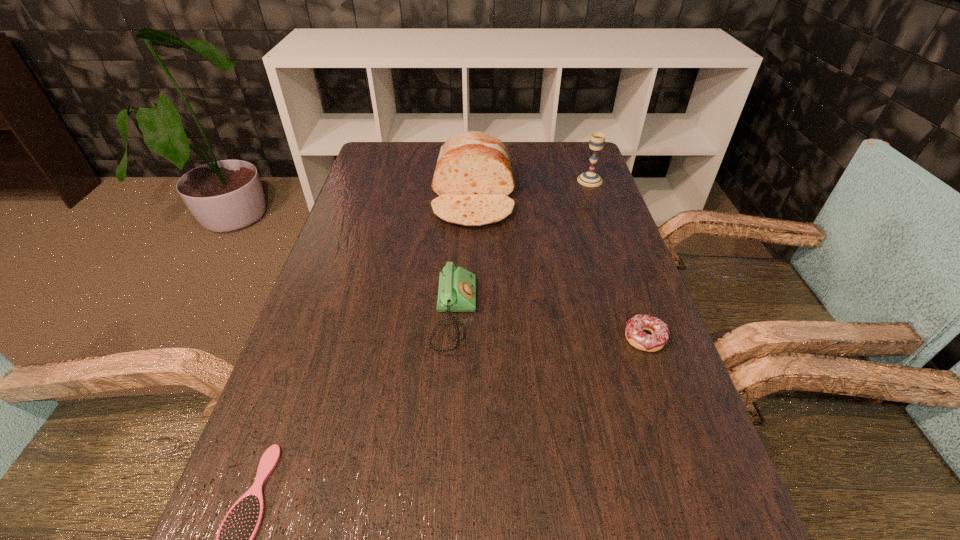
Identify the location of vacant space that is in between the chalice and the third shortest object. (522, 248).

Identify the location of vacant point located between the bread and the fourth tallest object. (559, 268).

At what (x,y) coordinates should I click in order to perform the action: click on vacant region between the fourth tallest object and the telephone. Please return your answer as a coordinate pair (x, y). The width and height of the screenshot is (960, 540). Looking at the image, I should click on (549, 327).

Locate an element on the screen. free space between the telephone and the bread is located at coordinates (464, 256).

Locate an element on the screen. The image size is (960, 540). unoccupied area between the doughnut and the bread is located at coordinates (559, 268).

Locate an element on the screen. vacant space in between the bread and the second shortest object is located at coordinates (559, 268).

The height and width of the screenshot is (540, 960). What are the coordinates of `object that ranks as the fourth closest to the fourth tallest object` in the screenshot? It's located at click(x=235, y=539).

The image size is (960, 540). I want to click on object that is the second closest to the second shortest object, so click(473, 178).

Find the location of a particular element. Image resolution: width=960 pixels, height=540 pixels. free location that satisfies the following two spatial constraints: 1. on the dial of the third tallest object; 2. on the right side of the doughnut is located at coordinates (453, 339).

Locate an element on the screen. The width and height of the screenshot is (960, 540). vacant space that satisfies the following two spatial constraints: 1. at the sliced end of the bread; 2. on the left side of the second shortest object is located at coordinates (470, 339).